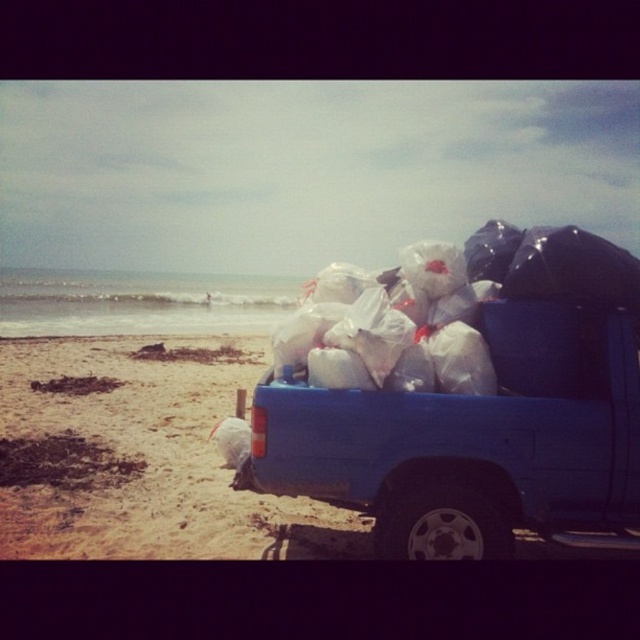
You are standing at the beach looking at the blue pickup truck. There are two points marked on the truck bed. The first point is at coordinate point (582, 449) and the second point is at coordinate point (413, 282). Which point appears closer to you?

Point (582, 449) is closer to the camera than point (413, 282), so the first point appears closer to you.

You are a photographer standing on the beach and want to take a photo of the blue matte truck at right and the white plastic bags at center. If you move forward, which object will appear larger in the photo?

The blue matte truck at right is closer to the viewer than the white plastic bags at center, so moving forward will make the blue matte truck at right appear larger in the photo.

You are a worker who needs to load more trash bags into the truck. Considering the height of the blue matte truck at right and the white plastic bags at center, will stacking the bags higher than the truck bed be possible?

The blue matte truck at right has a greater height compared to white plastic bags at center, so stacking the bags higher than the truck bed is possible as the truck is taller than the bags themselves.